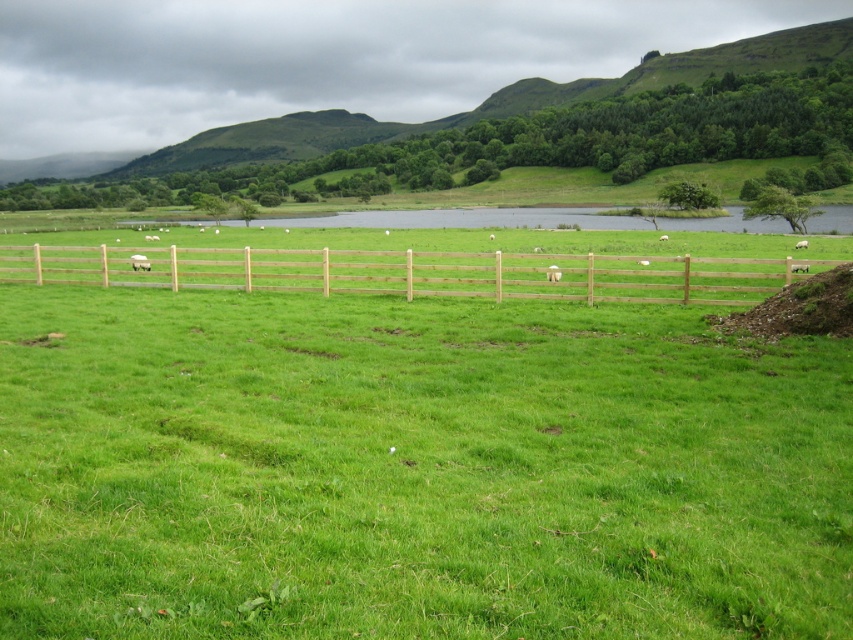
You are a farmer checking the condition of your animals. You notice two white objects at the center of the field. One is labeled as white woolly sheep at center and the other as white fluffy wool at center. Which object takes up more space horizontally?

The white fluffy wool at center takes up more space horizontally than the white woolly sheep at center since the white woolly sheep at center has a lesser width compared to white fluffy wool at center.

You are a farmer standing at the edge of the field and want to check if the brown wooden fence at center can block the view of the white woolly sheep at center from outside the field. Based on their heights, can the fence obscure the sheep?

The brown wooden fence at center is taller than the white woolly sheep at center, so yes, the fence can obscure the view of the sheep from outside the field.

You are a farmer checking the condition of your property. You notice the brown wooden fence at center and the white fluffy wool at center. Which object is taller?

The brown wooden fence at center is much taller than the white fluffy wool at center.